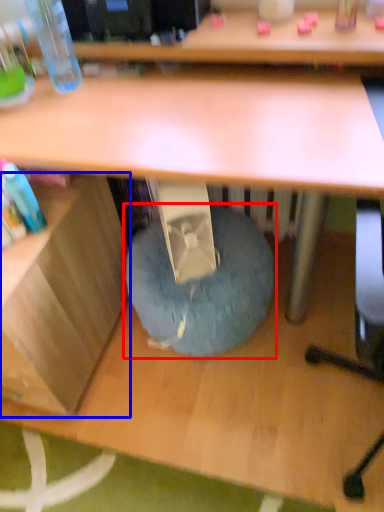
Question: Which object is closer to the camera taking this photo, bean bag chair (highlighted by a red box) or shelf (highlighted by a blue box)?

Choices:
 (A) bean bag chair
 (B) shelf

Answer: (B)